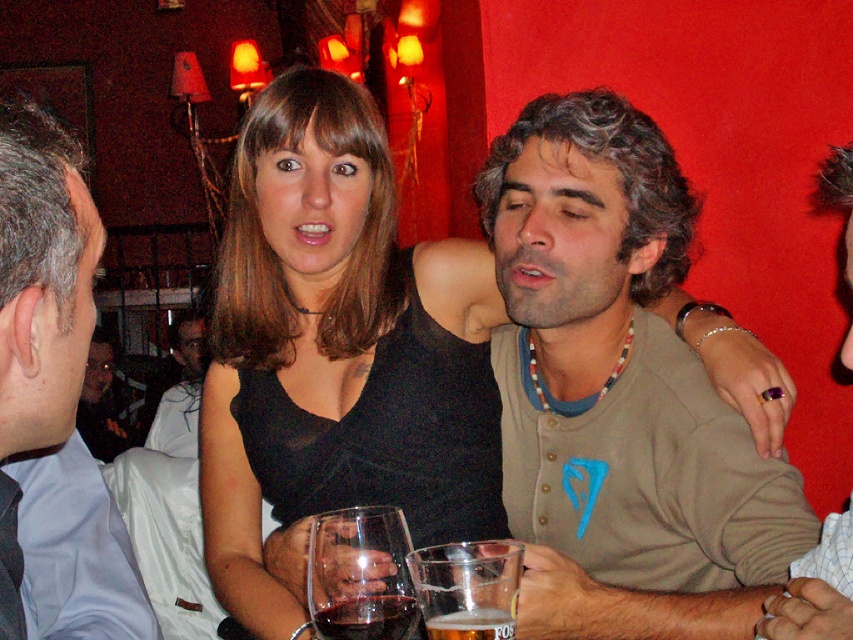
You are a bartender preparing a drink and notice a transparent glass at lower center and a purple ring at upper right. Which object has a smaller width?

The transparent glass at lower center has a lesser width compared to the purple ring at upper right.

You are standing in the bar and want to place a small coaster on the dark glass at lower center. The coaster has a diameter of 10 cm. What are the coordinates where you should place the coaster?

The dark glass at lower center is located at point (367, 618), so you should place the coaster at those coordinates.